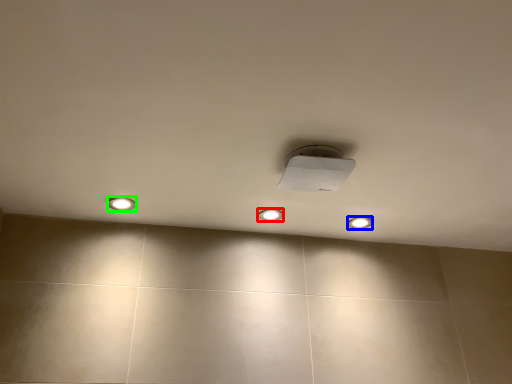
Question: Considering the real-world distances, which object is farthest from dot (highlighted by a red box)? dot (highlighted by a blue box) or dot (highlighted by a green box)?

Choices:
 (A) dot
 (B) dot

Answer: (B)